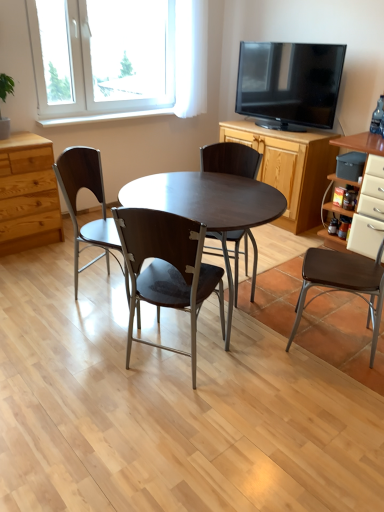
Question: Should I look upward or downward to see matte brown chair at left, acting as the 4th chair starting from the right?

Choices:
 (A) down
 (B) up

Answer: (B)

Question: Considering the relative sizes of white glossy cabinet at right, positioned as the first cabinetry in right-to-left order, and black glossy tv at upper right in the image provided, is white glossy cabinet at right, positioned as the first cabinetry in right-to-left order, shorter than black glossy tv at upper right?

Choices:
 (A) no
 (B) yes

Answer: (A)

Question: From a real-world perspective, is white glossy cabinet at right, positioned as the first cabinetry in right-to-left order, under black glossy tv at upper right?

Choices:
 (A) no
 (B) yes

Answer: (B)

Question: Can you confirm if white glossy cabinet at right, positioned as the first cabinetry in right-to-left order, is thinner than black glossy tv at upper right?

Choices:
 (A) yes
 (B) no

Answer: (B)

Question: From the image's perspective, is white glossy cabinet at right, marked as the second cabinetry in a left-to-right arrangement, below black glossy tv at upper right?

Choices:
 (A) no
 (B) yes

Answer: (B)

Question: Can you confirm if white glossy cabinet at right, positioned as the first cabinetry in right-to-left order, is taller than black glossy tv at upper right?

Choices:
 (A) yes
 (B) no

Answer: (A)

Question: Are white glossy cabinet at right, marked as the second cabinetry in a left-to-right arrangement, and black glossy tv at upper right far apart?

Choices:
 (A) yes
 (B) no

Answer: (B)

Question: From the image's perspective, is wooden cabinet at center right, marked as the 2th cabinetry in a right-to-left arrangement, located above transparent glass window at upper left?

Choices:
 (A) yes
 (B) no

Answer: (B)

Question: Is wooden cabinet at center right, marked as the 2th cabinetry in a right-to-left arrangement, thinner than transparent glass window at upper left?

Choices:
 (A) yes
 (B) no

Answer: (B)

Question: Is wooden cabinet at center right, marked as the 2th cabinetry in a right-to-left arrangement, positioned with its back to transparent glass window at upper left?

Choices:
 (A) yes
 (B) no

Answer: (B)

Question: Is wooden cabinet at center right, marked as the 2th cabinetry in a right-to-left arrangement, bigger than transparent glass window at upper left?

Choices:
 (A) yes
 (B) no

Answer: (A)

Question: Is transparent glass window at upper left located within wooden cabinet at center right, marked as the 2th cabinetry in a right-to-left arrangement?

Choices:
 (A) yes
 (B) no

Answer: (B)

Question: Is wooden cabinet at center right, marked as the 2th cabinetry in a right-to-left arrangement, positioned in front of transparent glass window at upper left?

Choices:
 (A) no
 (B) yes

Answer: (A)

Question: Can you confirm if matte brown chair at center, marked as the 2th chair in a left-to-right arrangement, is wider than matte brown chair at left, acting as the 4th chair starting from the right?

Choices:
 (A) yes
 (B) no

Answer: (B)